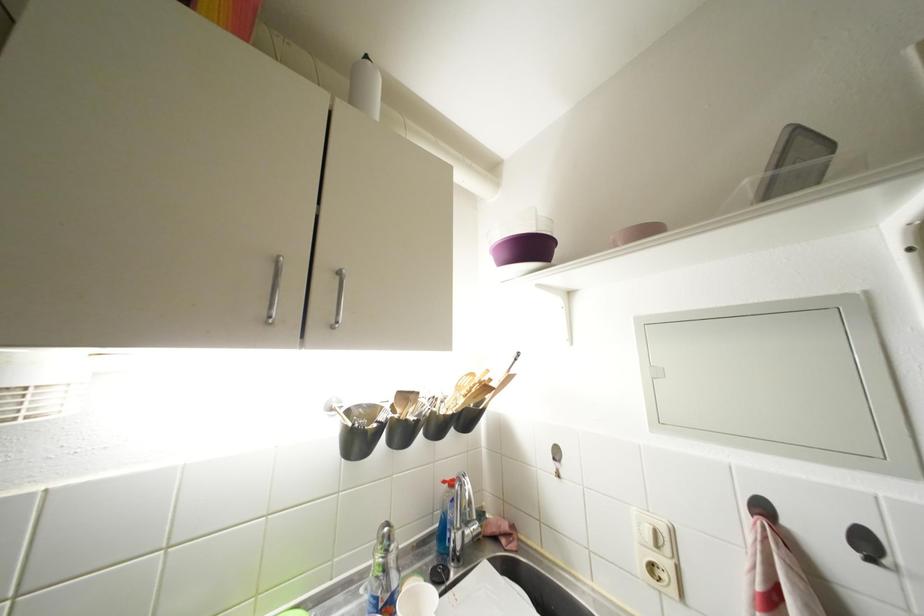
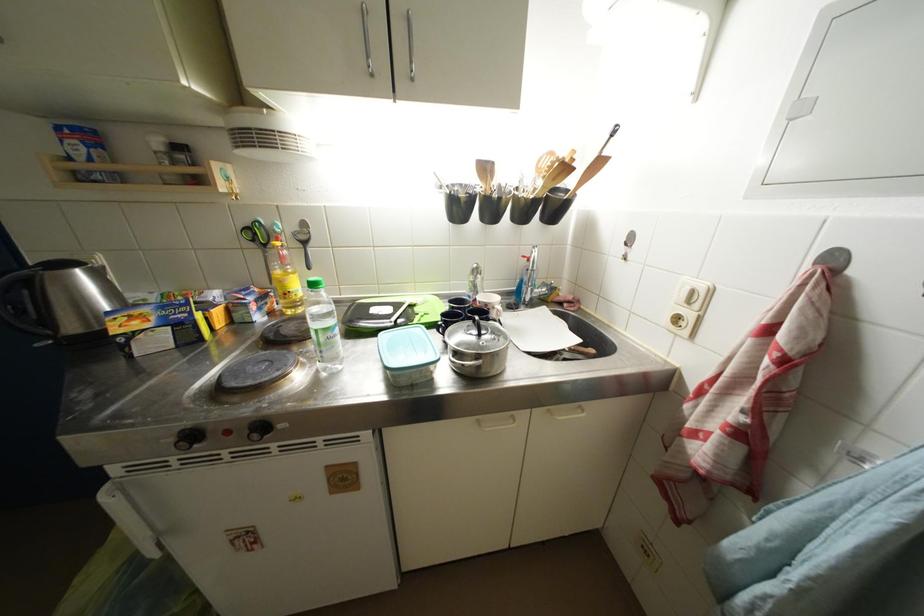
Find the pixel in the second image that matches pixel 487 387 in the first image.

(565, 164)